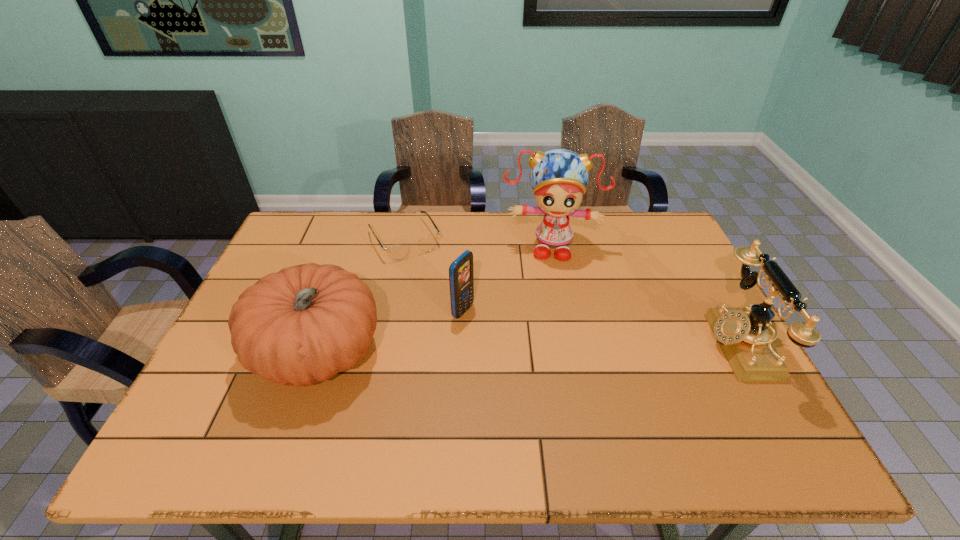
You are a GUI agent. You are given a task and a screenshot of the screen. Output one action in this format:
    pyautogui.click(x=<x>, y=<y>)
    Task: Click on the spectacles that is positioned at the far edge
    
    Given the screenshot: What is the action you would take?
    pyautogui.click(x=396, y=252)

Locate an element on the screen. Image resolution: width=960 pixels, height=540 pixels. pumpkin that is at the near edge is located at coordinates (304, 324).

I want to click on telephone that is positioned at the near edge, so click(x=741, y=332).

In order to click on object present at the left edge in this screenshot , I will do `click(304, 324)`.

I want to click on object that is at the right edge, so click(x=741, y=332).

Image resolution: width=960 pixels, height=540 pixels. In order to click on object that is positioned at the near left corner in this screenshot , I will do `click(304, 324)`.

Find the location of a particular element. This screenshot has width=960, height=540. object situated at the near right corner is located at coordinates (741, 332).

What are the coordinates of `vacant region at the far edge` in the screenshot? It's located at (448, 250).

Locate an element on the screen. This screenshot has width=960, height=540. vacant space at the near edge is located at coordinates (317, 415).

In the image, there is a desktop. Identify the location of vacant space at the right edge. Image resolution: width=960 pixels, height=540 pixels. (706, 307).